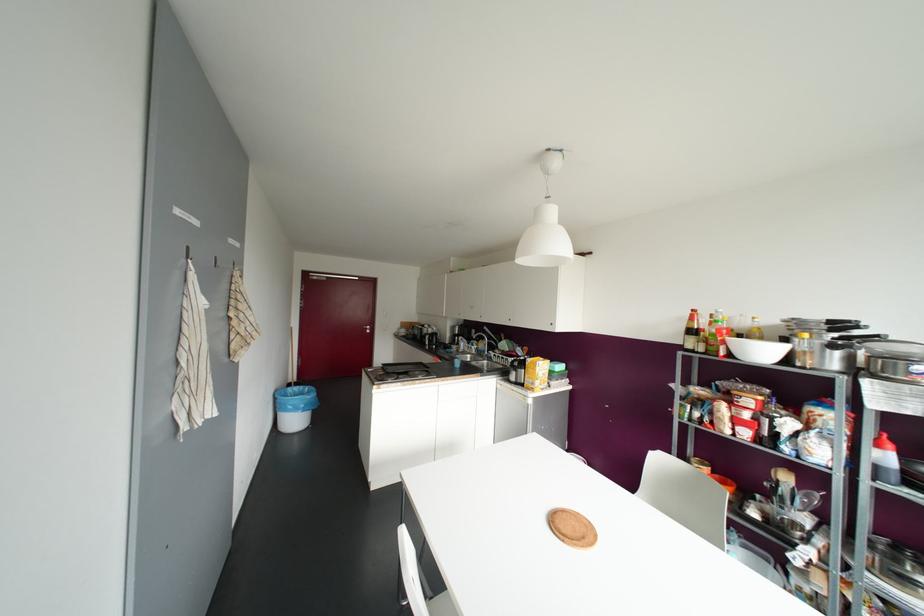
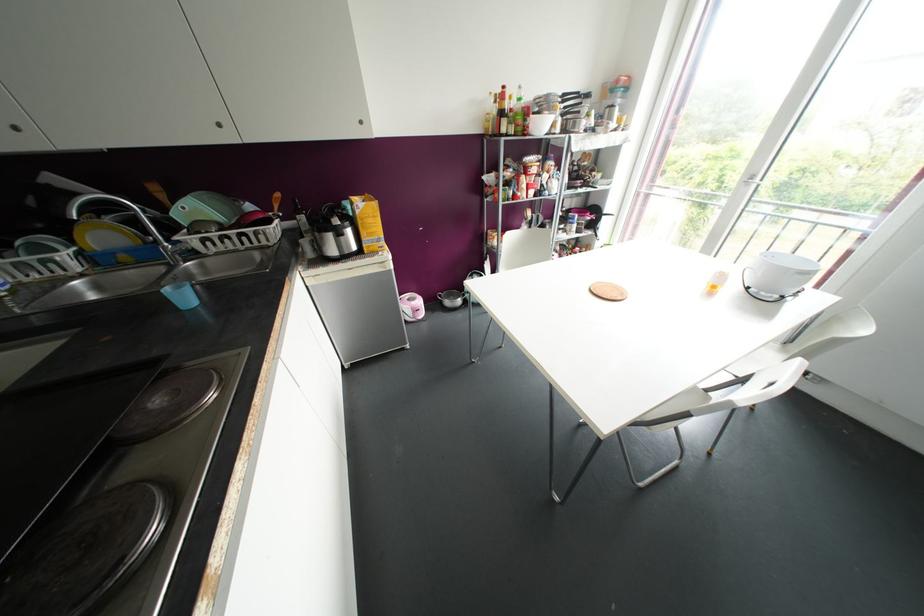
Question: I am providing you with two images of the same scene from different viewpoints. Please identify which objects are invisible in image2.

Choices:
 (A) yellow cereal box
 (B) silver door handle
 (C) blue plastic cup
 (D) none of these

Answer: (D)